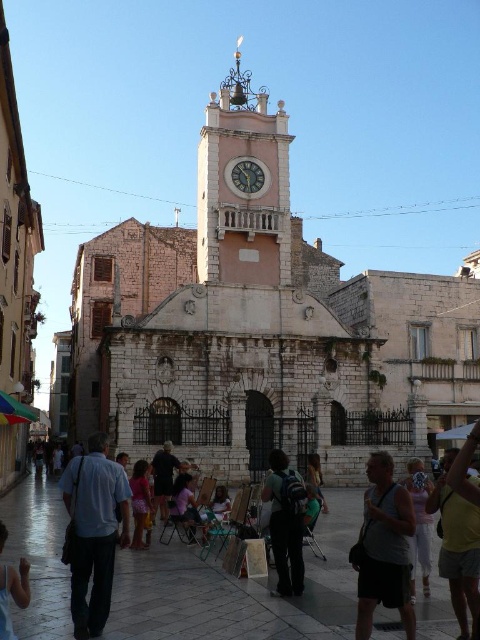
Question: Which of the following is the farthest from the observer?

Choices:
 (A) pink fabric dress at lower center
 (B) light pink stone clock tower at center
 (C) yellow cotton shirt at lower right
 (D) light blue cotton shirt at lower left

Answer: (B)

Question: Can you confirm if yellow cotton shirt at lower right is bigger than pink fabric dress at lower center?

Choices:
 (A) yes
 (B) no

Answer: (A)

Question: Does yellow cotton shirt at lower right appear on the right side of pink fabric dress at lower center?

Choices:
 (A) no
 (B) yes

Answer: (B)

Question: Among these points, which one is nearest to the camera?

Choices:
 (A) (310, 458)
 (B) (455, 452)
 (C) (78, 499)

Answer: (C)

Question: Estimate the real-world distances between objects in this image. Which object is farther from the gray fabric tank top at center?

Choices:
 (A) yellow cotton shirt at lower right
 (B) pink fabric at center
 (C) light pink stone clock tower at center

Answer: (C)

Question: Is pink fabric at center above gold metallic clock at center?

Choices:
 (A) no
 (B) yes

Answer: (A)